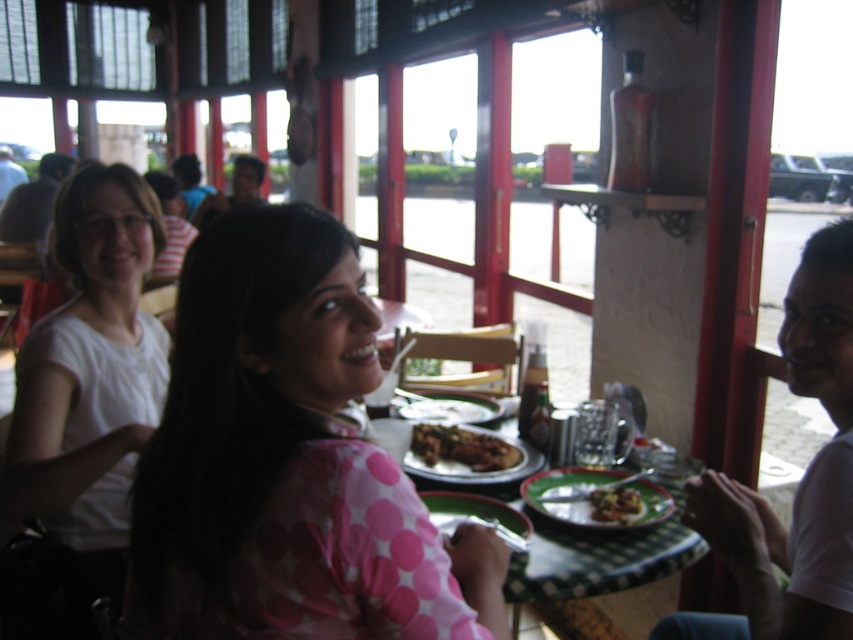
You are a photographer standing at the entrance of the restaurant. You want to take a photo of the pink dotted shirt at center without moving any objects. Can you capture it in your current position?

The pink dotted shirt at center is 34.08 inches away from the viewer, so yes, you can capture it in your current position as it is within a reasonable distance for photography without needing to move closer or adjust the camera angle significantly.

You are a photographer trying to capture a closeup of the shiny brown meat at lower right without including the matte white shirt at upper left in the frame. Given their sizes, which object would require a wider angle lens to include fully in the shot?

The matte white shirt at upper left is bigger than the shiny brown meat at lower right, so it would require a wider angle lens to include fully in the shot.

You are a photographer standing at the point marked by the coordinate point at point (x=305, y=356). You want to take a photo of the three people seated at the table. Considering the distance between you and the subjects, will you be able to capture all three individuals clearly in a single shot without needing to adjust your position?

The distance between you and the subjects is 94.64 centimeters. Since this distance is sufficient to capture all three individuals in a single shot, you can take the photo without needing to adjust your position.